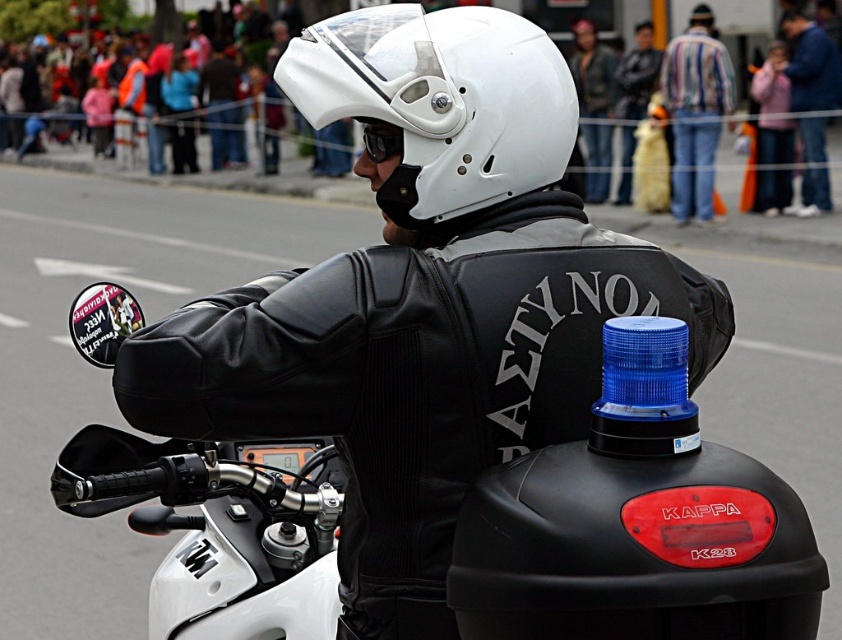
You are a police officer inspecting the motorcycle gear. You need to determine which item has a greater width between the white matte helmet at center and the black matte goggles at center. Based on the description, which one is wider?

The white matte helmet at center is wider than the black matte goggles at center according to the description.

You are a photographer at the event and need to capture a clear shot of both the striped shirt at center and the blue denim jacket at upper right. Which object should you focus on first to ensure both are in frame?

The striped shirt at center is positioned under the blue denim jacket at upper right, so focusing on the blue denim jacket at upper right first will allow the striped shirt at center to be captured below it within the same frame.